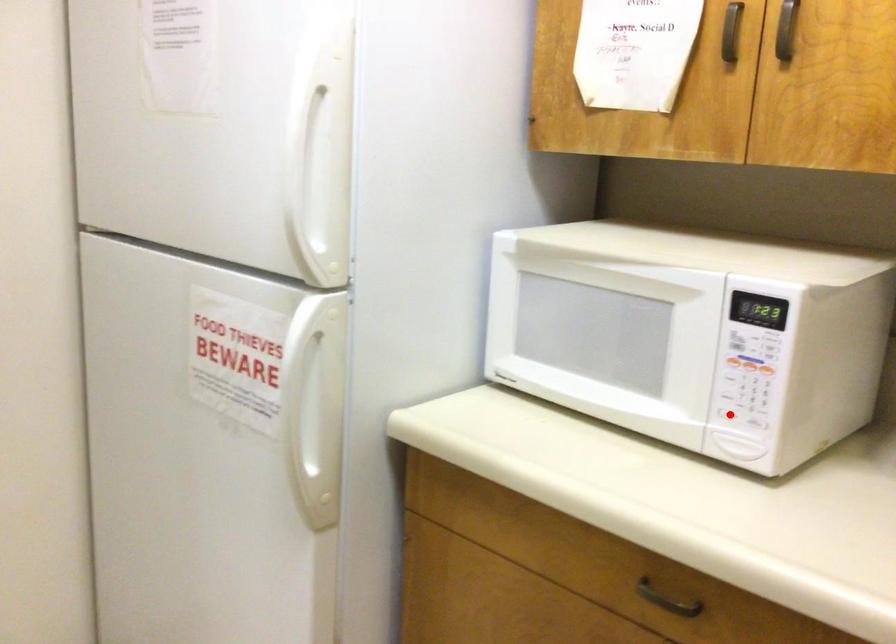
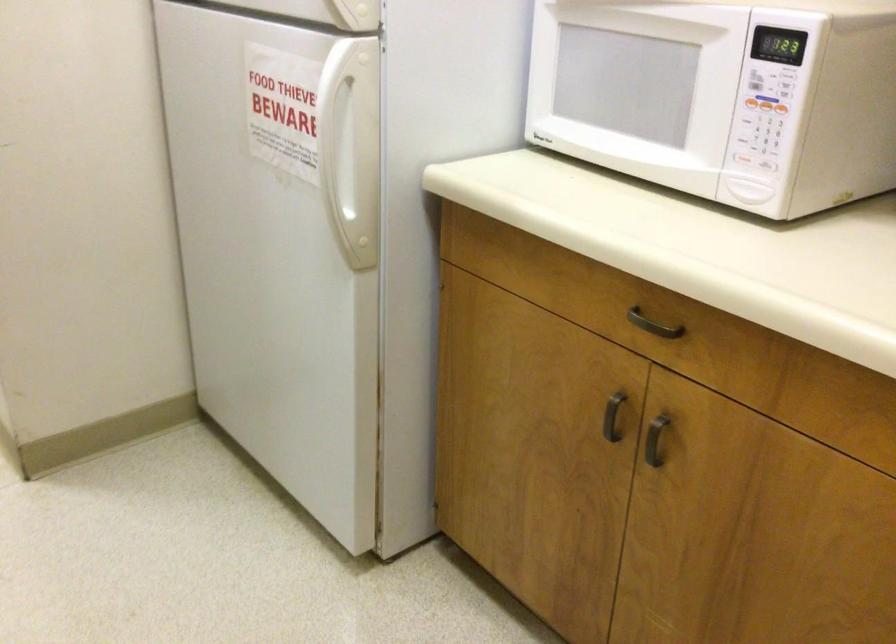
Locate, in the second image, the point that corresponds to the highlighted location in the first image.

(741, 158)